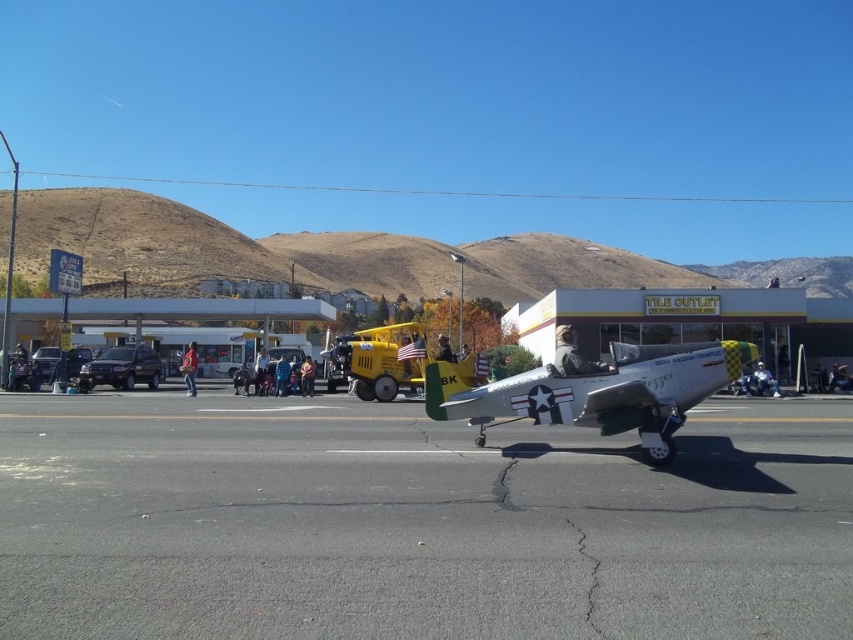
You are standing at the edge of the gray asphalt at center and want to get to the silver metallic airplane at center. Which direction should you move to reach it?

The gray asphalt at center is below the silver metallic airplane at center, so you should move upward to reach the silver metallic airplane at center.

You are standing at the edge of the gray asphalt at center and want to walk to the silver metallic airplane at center. Which direction should you walk to reach the airplane?

The gray asphalt at center is to the left of the silver metallic airplane at center, so you should walk to the right to reach the airplane.